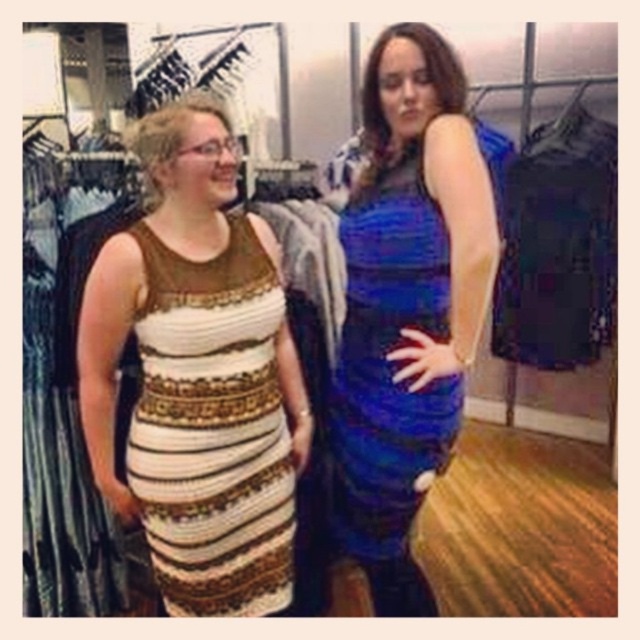
Question: Which of the following is the farthest from the observer?

Choices:
 (A) (467, 124)
 (B) (256, 406)

Answer: (B)

Question: Is shiny blue dress at center above white textured dress at center?

Choices:
 (A) no
 (B) yes

Answer: (B)

Question: Which point is closer to the camera?

Choices:
 (A) shiny blue dress at center
 (B) white textured dress at center

Answer: (A)

Question: Is shiny blue dress at center smaller than white textured dress at center?

Choices:
 (A) yes
 (B) no

Answer: (B)

Question: Considering the relative positions of shiny blue dress at center and white textured dress at center in the image provided, where is shiny blue dress at center located with respect to white textured dress at center?

Choices:
 (A) left
 (B) right

Answer: (B)